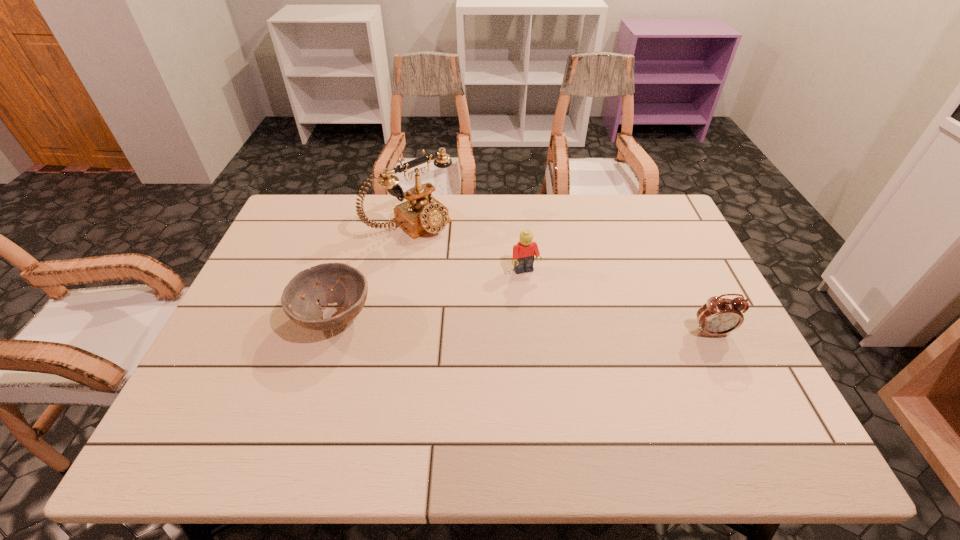
Find the location of a particular element. The height and width of the screenshot is (540, 960). free space at the far left corner of the desktop is located at coordinates (313, 210).

Identify the location of vacant area at the far right corner. The width and height of the screenshot is (960, 540). (666, 228).

What are the coordinates of `vacant region between the bowl and the third object from left to right` in the screenshot? It's located at (430, 294).

What are the coordinates of `free space between the rightmost object and the bowl` in the screenshot? It's located at (523, 325).

Identify the location of free point between the bowl and the tallest object. This screenshot has width=960, height=540. (372, 271).

Where is `vacant point located between the third object from left to right and the farthest object`? The width and height of the screenshot is (960, 540). vacant point located between the third object from left to right and the farthest object is located at coordinates (468, 248).

The height and width of the screenshot is (540, 960). I want to click on vacant area that lies between the shortest object and the farthest object, so click(372, 271).

Identify the location of free spot between the farthest object and the third nearest object. The width and height of the screenshot is (960, 540). (468, 248).

The width and height of the screenshot is (960, 540). I want to click on vacant area between the alarm clock and the third object from left to right, so click(x=619, y=302).

Find the location of a particular element. This screenshot has width=960, height=540. free space between the bowl and the alarm clock is located at coordinates (523, 325).